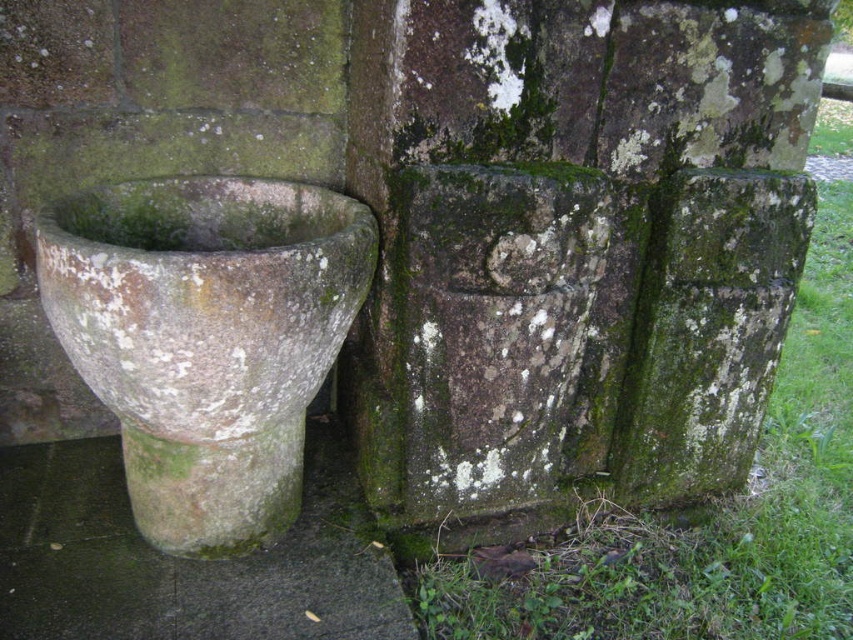
Question: Does green mossy stone at center appear under speckled stone basin at left?

Choices:
 (A) yes
 (B) no

Answer: (B)

Question: Which is nearer to the green mossy stone pot at lower left?

Choices:
 (A) speckled stone basin at left
 (B) green mossy stone at center

Answer: (A)

Question: Which object is closer to the camera taking this photo?

Choices:
 (A) green mossy stone at center
 (B) speckled stone basin at left
 (C) green mossy stone pot at lower left

Answer: (B)

Question: Is green mossy stone at center to the right of green mossy stone pot at lower left from the viewer's perspective?

Choices:
 (A) yes
 (B) no

Answer: (A)

Question: Does speckled stone basin at left lie behind green mossy stone pot at lower left?

Choices:
 (A) yes
 (B) no

Answer: (B)

Question: Among these objects, which one is nearest to the camera?

Choices:
 (A) green mossy stone pot at lower left
 (B) speckled stone basin at left

Answer: (B)